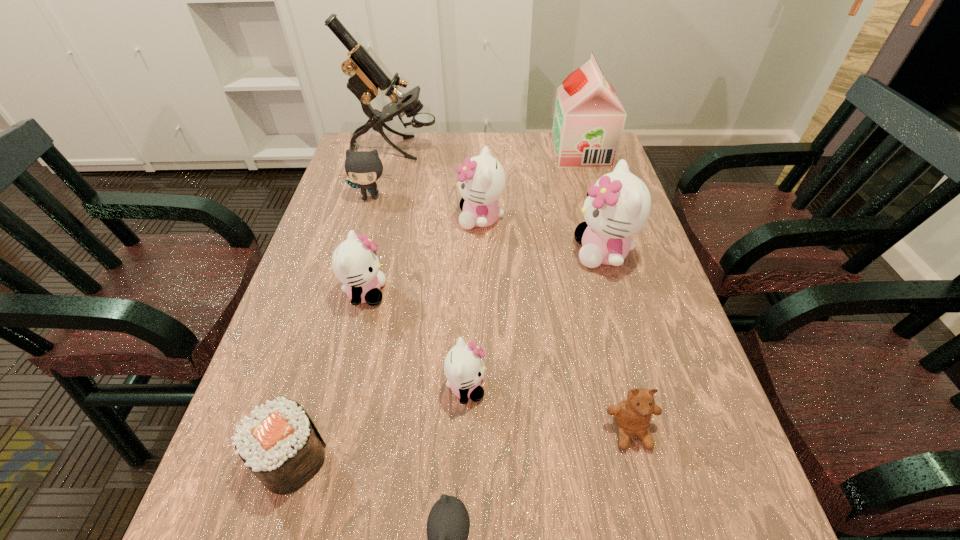
Select which white kitten is the third closest to the fourth tallest object. Please provide its 2D coordinates. Your answer should be formatted as a tuple, i.e. [(x, y)], where the tuple contains the x and y coordinates of a point satisfying the conditions above.

[(464, 369)]

Image resolution: width=960 pixels, height=540 pixels. Identify the location of the fourth closest white kitten to the teddy bear. (482, 180).

I want to click on free location that satisfies the following two spatial constraints: 1. through the eyepiece of the tallest object; 2. on the front-facing side of the bigger gray kitten, so click(382, 197).

Locate an element on the screen. free spot that satisfies the following two spatial constraints: 1. with the cap open on the second tallest object; 2. on the front-facing side of the farther gray kitten is located at coordinates (594, 197).